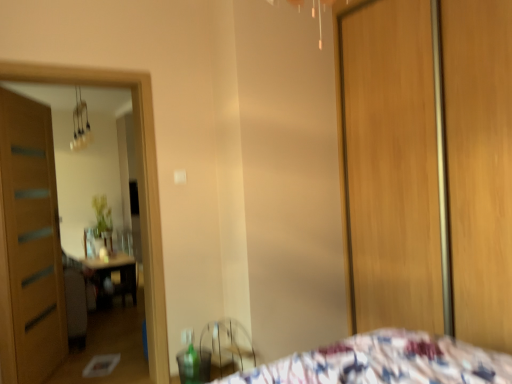
Question: From a real-world perspective, is wooden screen door at right physically above metallic glass chandelier at upper left?

Choices:
 (A) yes
 (B) no

Answer: (B)

Question: Is wooden screen door at right positioned behind metallic glass chandelier at upper left?

Choices:
 (A) yes
 (B) no

Answer: (B)

Question: Does wooden screen door at right appear on the right side of metallic glass chandelier at upper left?

Choices:
 (A) no
 (B) yes

Answer: (B)

Question: From the image's perspective, is wooden screen door at right below metallic glass chandelier at upper left?

Choices:
 (A) no
 (B) yes

Answer: (B)

Question: Are wooden screen door at right and metallic glass chandelier at upper left beside each other?

Choices:
 (A) no
 (B) yes

Answer: (A)

Question: Can you confirm if wooden screen door at right is taller than metallic glass chandelier at upper left?

Choices:
 (A) no
 (B) yes

Answer: (B)

Question: Is metallic glass chandelier at upper left located within wooden door at left?

Choices:
 (A) no
 (B) yes

Answer: (A)

Question: From a real-world perspective, is wooden door at left located higher than metallic glass chandelier at upper left?

Choices:
 (A) no
 (B) yes

Answer: (A)

Question: From a real-world perspective, does wooden door at left sit lower than metallic glass chandelier at upper left?

Choices:
 (A) yes
 (B) no

Answer: (A)

Question: Does wooden door at left have a lesser height compared to metallic glass chandelier at upper left?

Choices:
 (A) yes
 (B) no

Answer: (B)

Question: Is wooden door at left outside of metallic glass chandelier at upper left?

Choices:
 (A) no
 (B) yes

Answer: (B)

Question: Is wooden door at left bigger than metallic glass chandelier at upper left?

Choices:
 (A) no
 (B) yes

Answer: (B)

Question: Is wooden screen door at right facing towards wooden door at left?

Choices:
 (A) no
 (B) yes

Answer: (A)